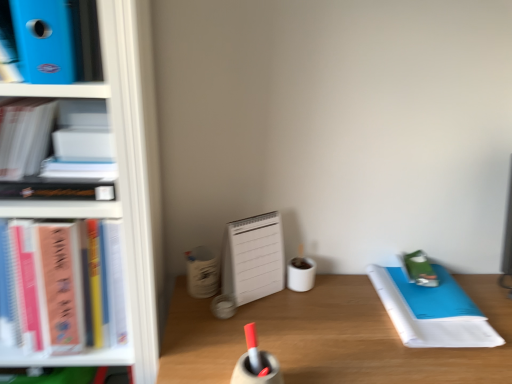
Image resolution: width=512 pixels, height=384 pixels. What are the coordinates of `empty space that is ontop of white paper notebook at right (from a real-world perspective)` in the screenshot? It's located at (431, 304).